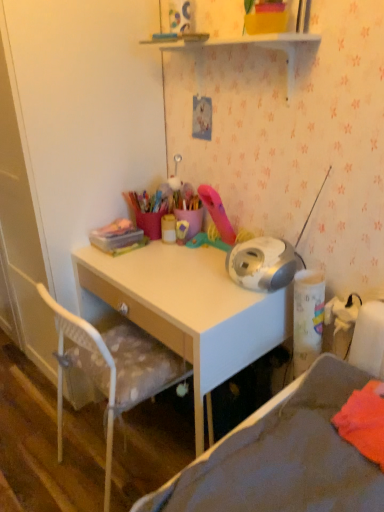
The image size is (384, 512). Find the location of `unoccupied area in front of matte yellow container at center, positioned as the 1th stationery in right-to-left order`. unoccupied area in front of matte yellow container at center, positioned as the 1th stationery in right-to-left order is located at coordinates (167, 260).